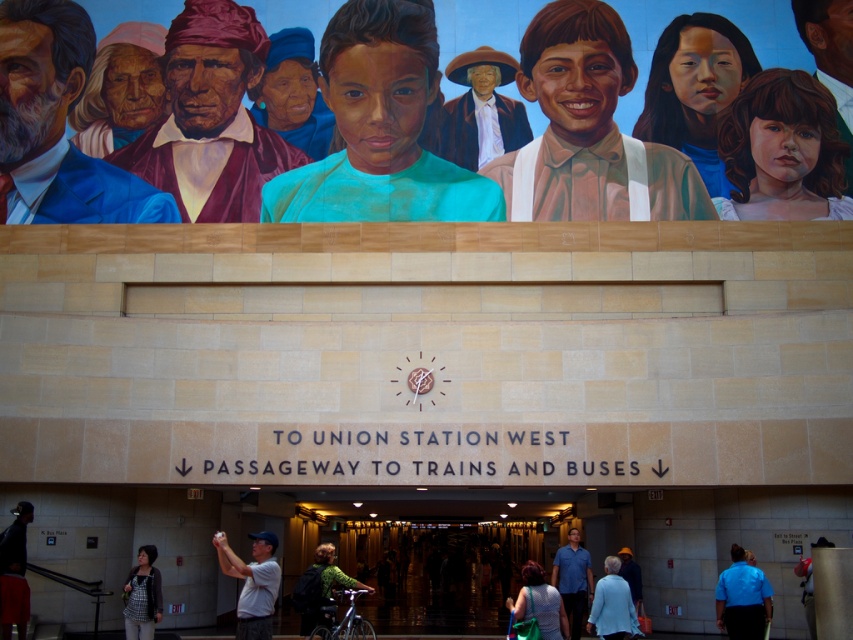
In the scene shown: Who is higher up, matte brown shirt at center or matte brown hat at center?

matte brown hat at center is above.

Can you confirm if matte brown shirt at center is positioned above matte brown hat at center?

Incorrect, matte brown shirt at center is not positioned above matte brown hat at center.

The width and height of the screenshot is (853, 640). In order to click on matte brown shirt at center in this screenshot , I will do `click(577, 109)`.

I want to click on matte brown shirt at center, so click(x=577, y=109).

Is matte blue suit at upper left taller than dark blue shirt at lower left?

Yes, matte blue suit at upper left is taller than dark blue shirt at lower left.

The width and height of the screenshot is (853, 640). Identify the location of matte blue suit at upper left. (56, 125).

Who is more forward, (35,179) or (4,577)?

Point (4,577) is more forward.

Image resolution: width=853 pixels, height=640 pixels. Find the location of `matte blue suit at upper left`. matte blue suit at upper left is located at coordinates [56, 125].

Does teal matte shirt at center have a lesser width compared to blue cotton shirt at center?

In fact, teal matte shirt at center might be wider than blue cotton shirt at center.

Is point (412, 138) more distant than point (572, 596)?

Yes, point (412, 138) is behind point (572, 596).

Between point (263, 196) and point (579, 618), which one is positioned in front?

Point (579, 618) is in front.

This screenshot has width=853, height=640. Identify the location of teal matte shirt at center. click(380, 129).